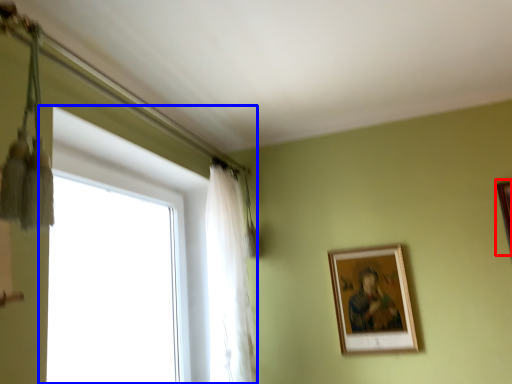
Question: Which object appears closest to the camera in this image, picture frame (highlighted by a red box) or window (highlighted by a blue box)?

Choices:
 (A) picture frame
 (B) window

Answer: (B)